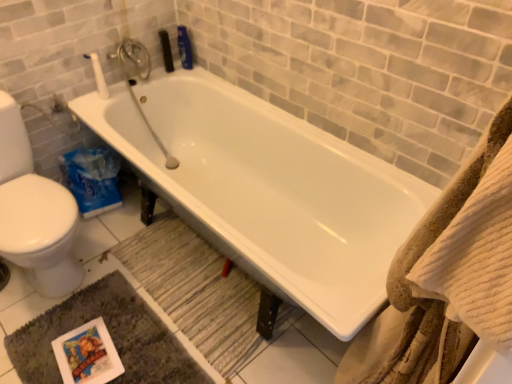
Question: Is white glossy bathtub at center inside dark gray plush bath mat at lower left, arranged as the first bath mat when ordered from the bottom?

Choices:
 (A) yes
 (B) no

Answer: (B)

Question: Does dark gray plush bath mat at lower left, arranged as the first bath mat when ordered from the bottom, lie behind white glossy bathtub at center?

Choices:
 (A) no
 (B) yes

Answer: (B)

Question: Does dark gray plush bath mat at lower left, arranged as the first bath mat when ordered from the bottom, turn towards white glossy bathtub at center?

Choices:
 (A) no
 (B) yes

Answer: (A)

Question: Is dark gray plush bath mat at lower left, which ranks as the second bath mat in top-to-bottom order, bigger than white glossy bathtub at center?

Choices:
 (A) yes
 (B) no

Answer: (B)

Question: Is dark gray plush bath mat at lower left, arranged as the first bath mat when ordered from the bottom, looking in the opposite direction of white glossy bathtub at center?

Choices:
 (A) no
 (B) yes

Answer: (A)

Question: From a real-world perspective, is wooden textured bath mat at lower center, which is counted as the 2th bath mat, starting from the bottom, positioned above or below white matte toilet paper at upper left?

Choices:
 (A) above
 (B) below

Answer: (B)

Question: Looking at their shapes, would you say wooden textured bath mat at lower center, which is counted as the 2th bath mat, starting from the bottom, is wider or thinner than white matte toilet paper at upper left?

Choices:
 (A) thin
 (B) wide

Answer: (B)

Question: Visually, is wooden textured bath mat at lower center, which is counted as the 2th bath mat, starting from the bottom, positioned to the left or to the right of white matte toilet paper at upper left?

Choices:
 (A) left
 (B) right

Answer: (B)

Question: Is wooden textured bath mat at lower center, which is counted as the 2th bath mat, starting from the bottom, bigger or smaller than white matte toilet paper at upper left?

Choices:
 (A) small
 (B) big

Answer: (B)

Question: From the image's perspective, is white glossy bathtub at center above or below dark gray plush bath mat at lower left, arranged as the first bath mat when ordered from the bottom?

Choices:
 (A) below
 (B) above

Answer: (B)

Question: Is point [x=271, y=193] positioned closer to the camera than point [x=150, y=372]?

Choices:
 (A) farther
 (B) closer

Answer: (A)

Question: From a real-world perspective, relative to dark gray plush bath mat at lower left, which ranks as the second bath mat in top-to-bottom order, is white glossy bathtub at center vertically above or below?

Choices:
 (A) below
 (B) above

Answer: (B)

Question: Would you say white glossy bathtub at center is to the left or to the right of dark gray plush bath mat at lower left, arranged as the first bath mat when ordered from the bottom, in the picture?

Choices:
 (A) left
 (B) right

Answer: (B)

Question: From the image's perspective, is white matte toilet paper at upper left located above or below dark gray plush bath mat at lower left, arranged as the first bath mat when ordered from the bottom?

Choices:
 (A) above
 (B) below

Answer: (A)

Question: Considering their positions, is white matte toilet paper at upper left located in front of or behind dark gray plush bath mat at lower left, which ranks as the second bath mat in top-to-bottom order?

Choices:
 (A) front
 (B) behind

Answer: (B)